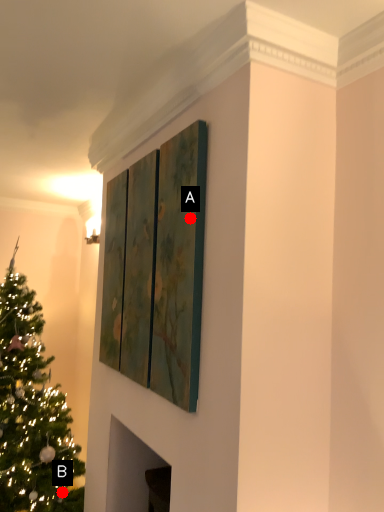
Question: Two points are circled on the image, labeled by A and B beside each circle. Which point is farther to the camera?

Choices:
 (A) A is further
 (B) B is further

Answer: (B)